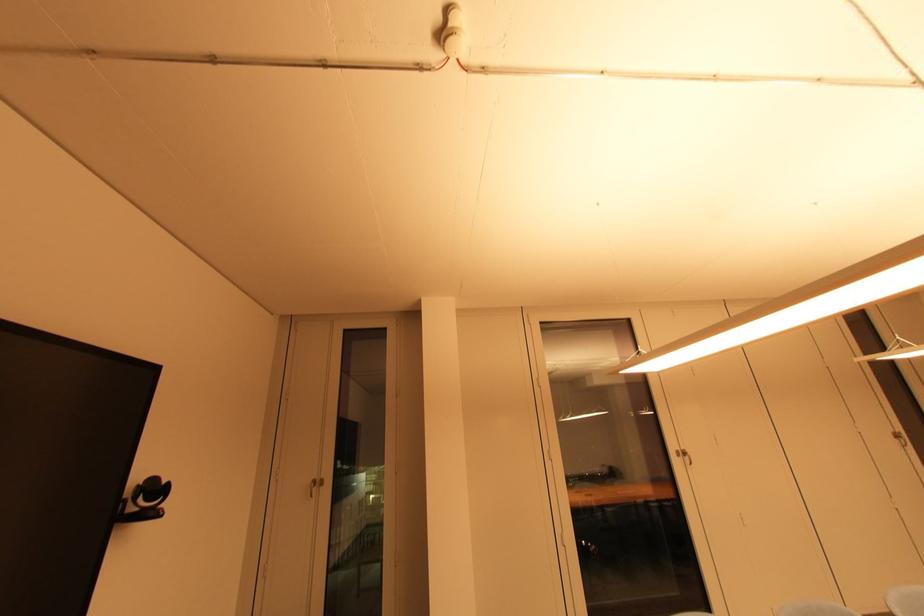
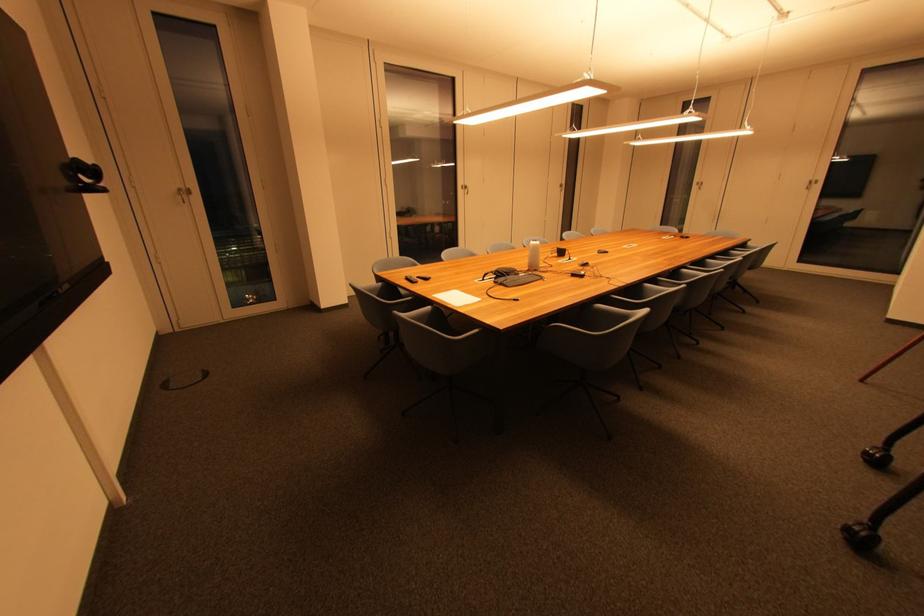
The point at (175,485) is marked in the first image. Where is the corresponding point in the second image?

(101, 168)